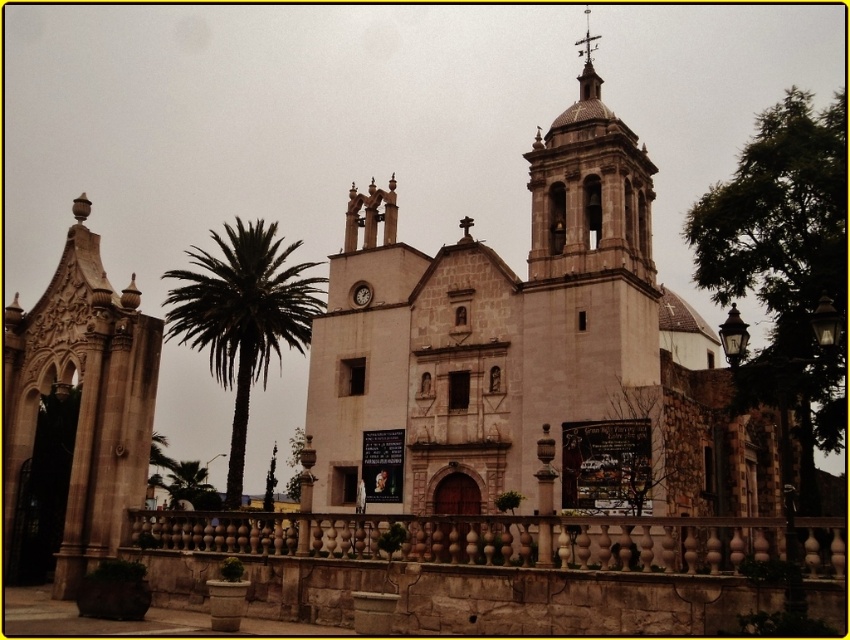
Question: Which point appears closest to the camera in this image?

Choices:
 (A) (332, 618)
 (B) (709, 449)
 (C) (269, 344)

Answer: (A)

Question: Which point is farther from the camera taking this photo?

Choices:
 (A) (595, 262)
 (B) (241, 369)
 (C) (595, 45)
 (D) (361, 300)

Answer: (B)

Question: Where is beige stone church at center located in relation to green leafy palm tree at center in the image?

Choices:
 (A) below
 (B) above

Answer: (B)

Question: Based on their relative distances, which object is farther from the polished copper spire at upper center?

Choices:
 (A) green leafy palm tree at center
 (B) matte brown clock at center
 (C) brown stone fence at lower center
 (D) beige stone church at center

Answer: (C)

Question: Is beige stone church at center smaller than brown stone fence at lower center?

Choices:
 (A) yes
 (B) no

Answer: (B)

Question: Does polished copper spire at upper center come in front of matte brown clock at center?

Choices:
 (A) yes
 (B) no

Answer: (A)